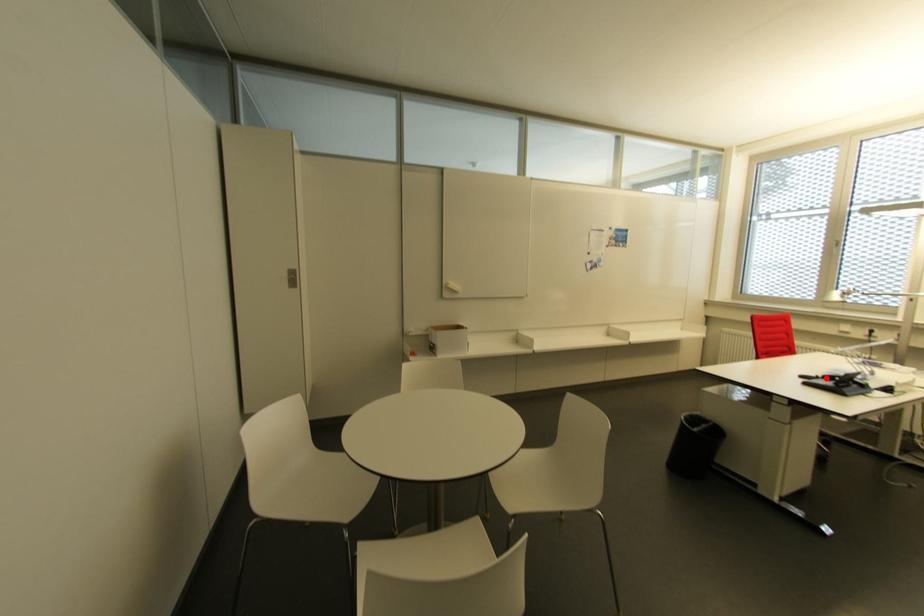
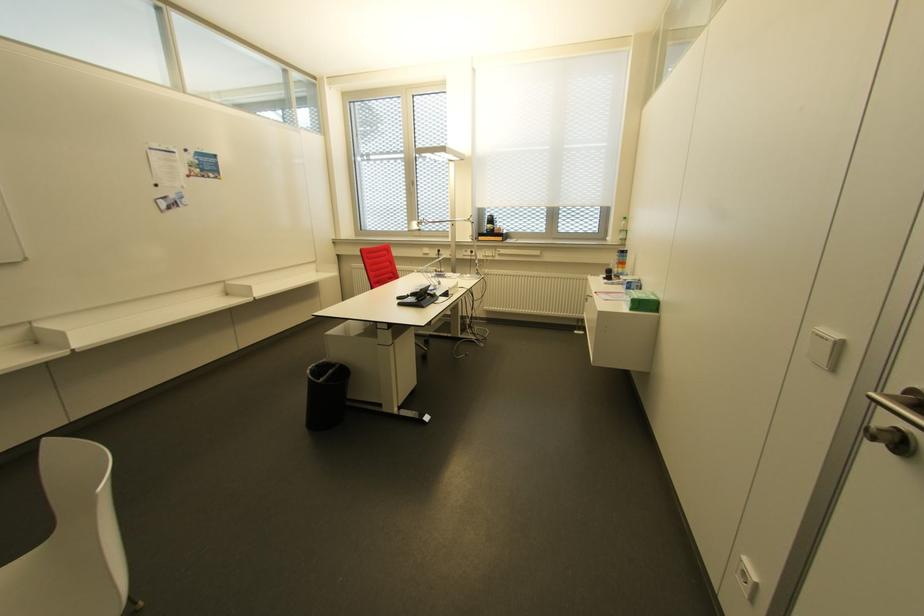
In the second image, find the point that corresponds to the highlighted location in the first image.

(410, 294)